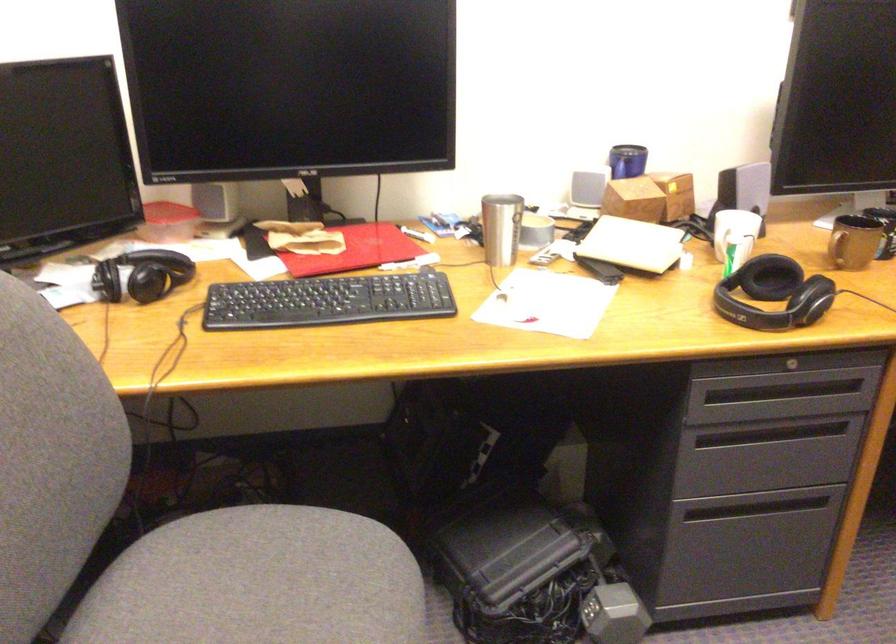
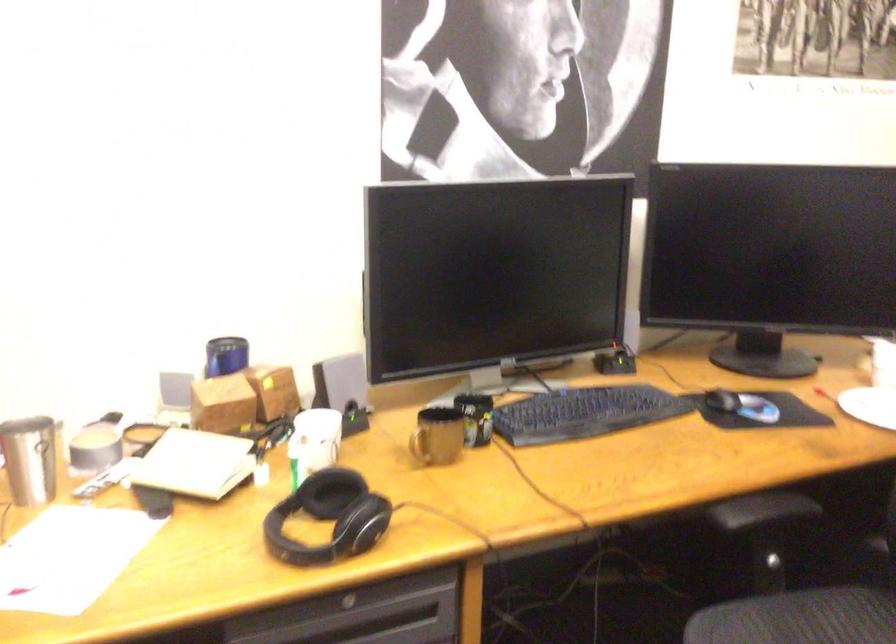
The point at [640,194] is marked in the first image. Where is the corresponding point in the second image?

(222, 404)